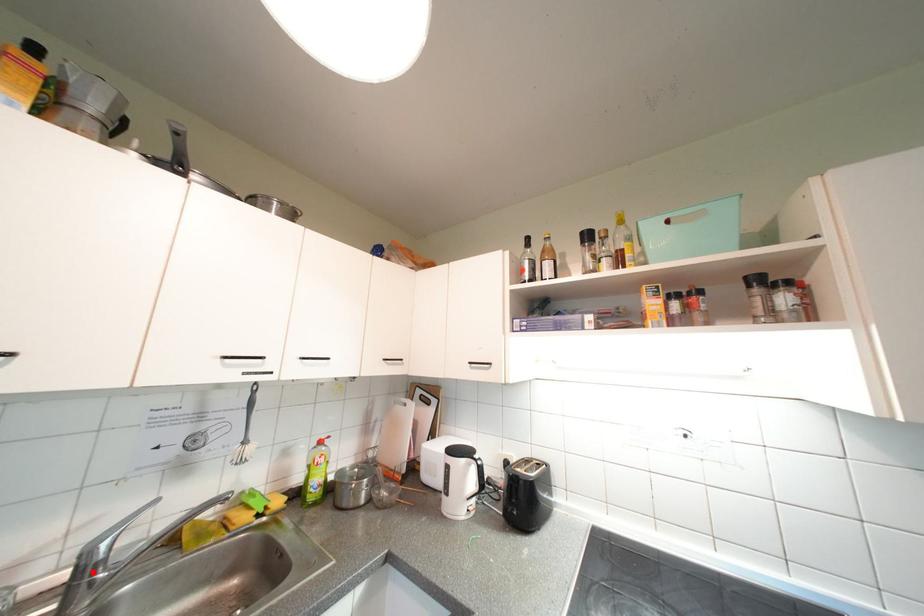
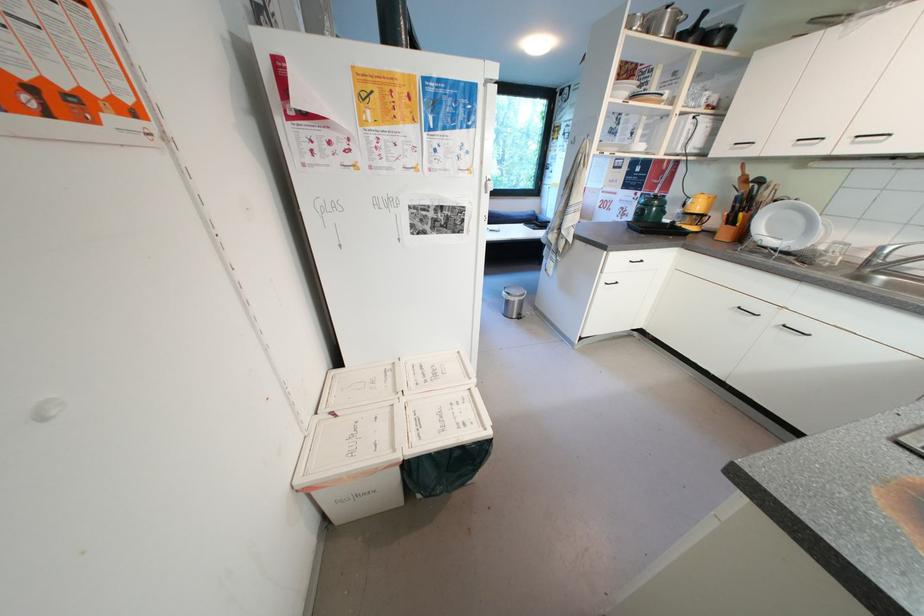
Question: I am providing you with two images of the same scene from different viewpoints. A red point is shown in image1. For the corresponding object point in image2, is it positioned nearer or farther from the camera?

Choices:
 (A) Nearer
 (B) Farther

Answer: (B)